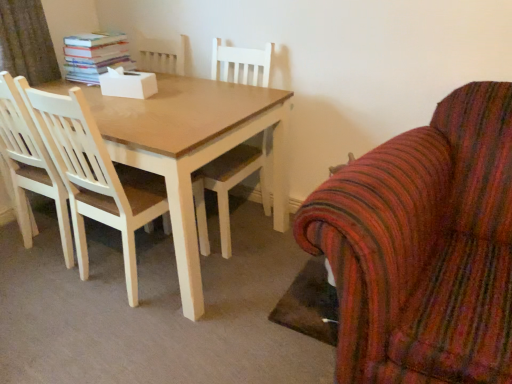
Question: Considering the positions of light wood chair at left, which is the 2th chair from right to left, and striped fabric armchair at right, the second chair when ordered from left to right, in the image, is light wood chair at left, which is the 2th chair from right to left, wider or thinner than striped fabric armchair at right, the second chair when ordered from left to right,?

Choices:
 (A) thin
 (B) wide

Answer: (A)

Question: From a real-world perspective, is light wood chair at left, positioned as the 1th chair in left-to-right order, above or below striped fabric armchair at right, marked as the 1th chair in a right-to-left arrangement?

Choices:
 (A) above
 (B) below

Answer: (A)

Question: Based on their relative distances, which object is nearer to the hardcover books at upper left?

Choices:
 (A) striped fabric armchair at right, the second chair when ordered from left to right
 (B) light wood chair at left, positioned as the 1th chair in left-to-right order

Answer: (B)

Question: Which object is positioned closest to the striped fabric armchair at right, marked as the 1th chair in a right-to-left arrangement?

Choices:
 (A) hardcover books at upper left
 (B) light wood chair at left, which is the 2th chair from right to left

Answer: (B)